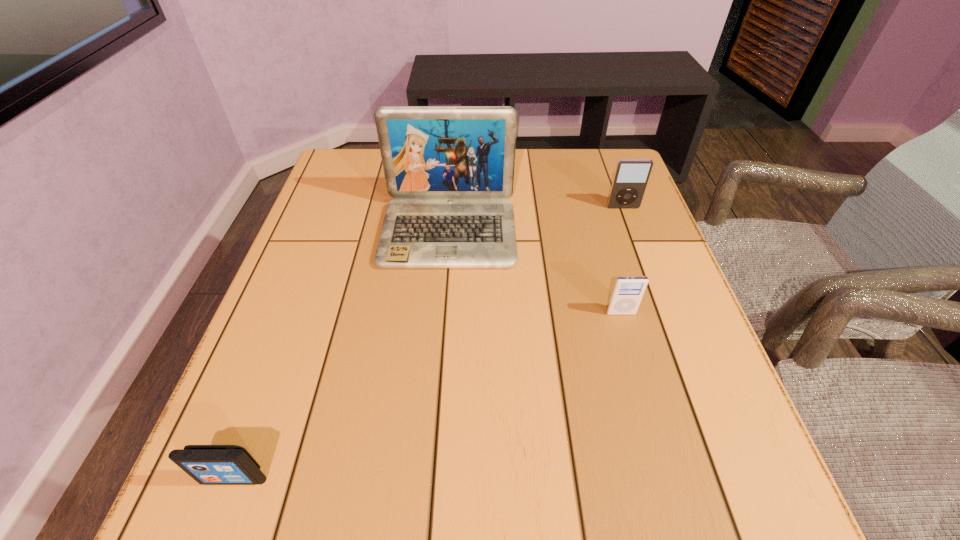
The height and width of the screenshot is (540, 960). What are the coordinates of `the third closest object relative to the laptop computer` in the screenshot? It's located at (207, 464).

Locate an element on the screen. object that is the second closest to the farthest iPod is located at coordinates (x=627, y=292).

Find the location of a particular element. The width and height of the screenshot is (960, 540). iPod that is the second closest one to the nearest object is located at coordinates (631, 176).

Locate which iPod is the closest to the farthest iPod. Please provide its 2D coordinates. Your answer should be formatted as a tuple, i.e. [(x, y)], where the tuple contains the x and y coordinates of a point satisfying the conditions above.

[(627, 292)]